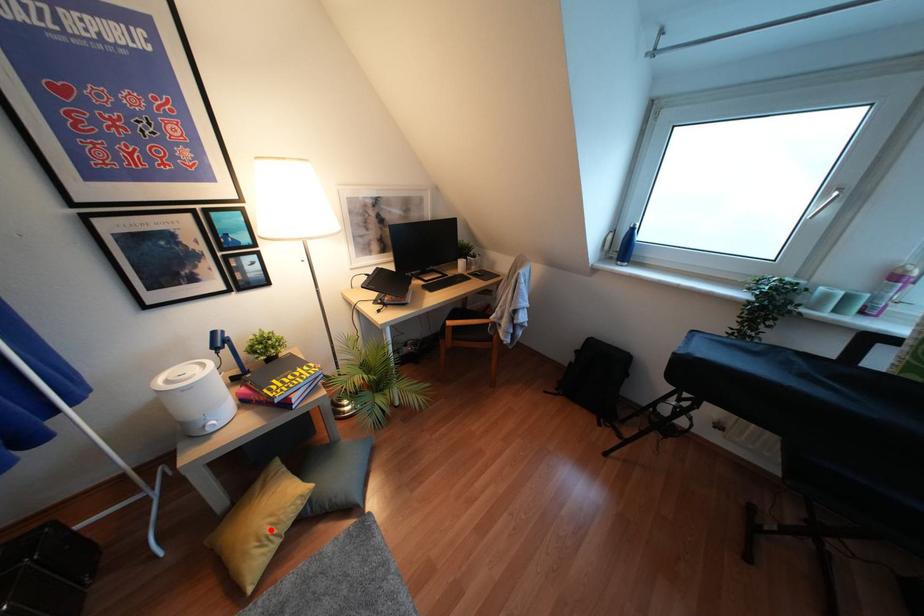
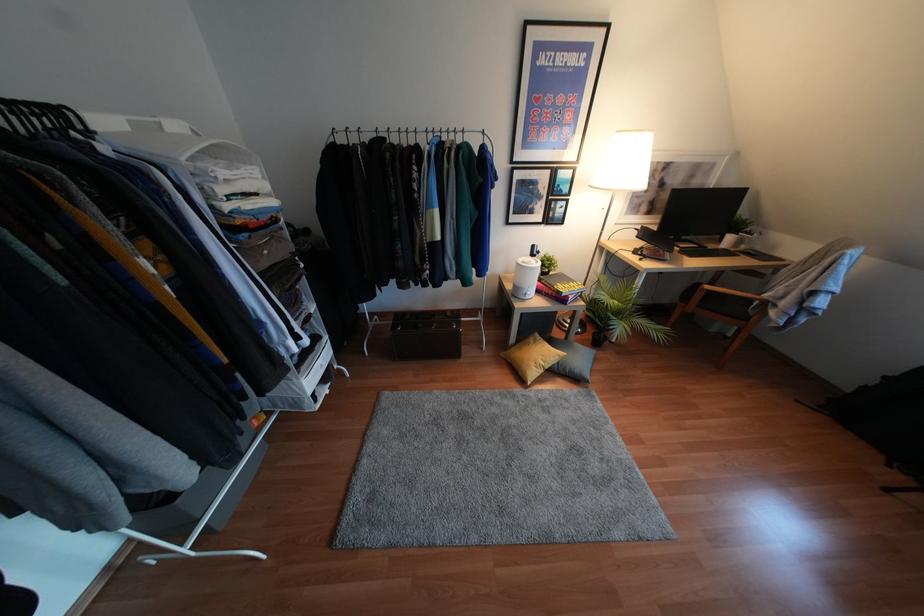
In the second image, find the point that corresponds to the highlighted location in the first image.

(541, 363)